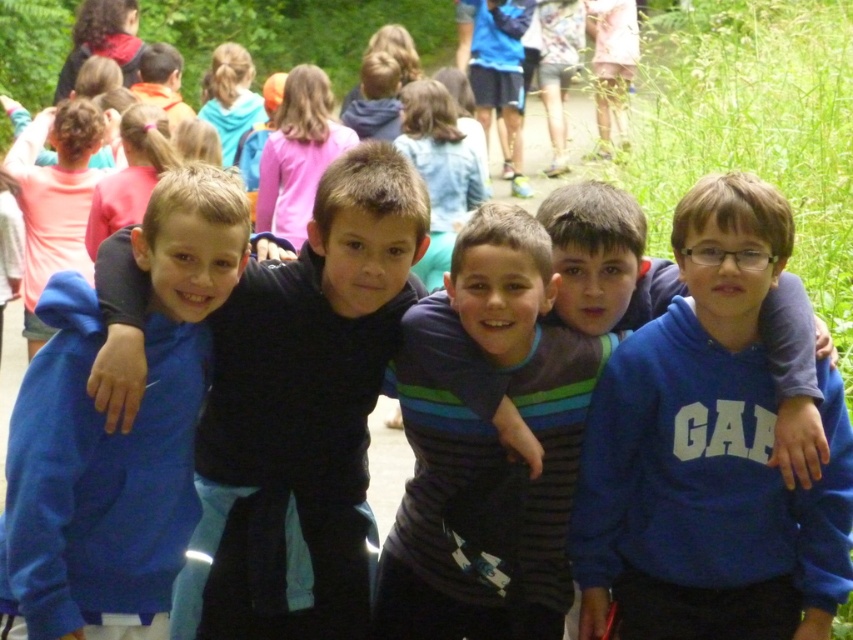
You are a photographer trying to capture a closeup of the blue fleece sweatshirt at center. Since the blue fleece jacket at center is blocking your view, can you determine which item you should adjust to get a clear shot?

The blue fleece sweatshirt at center is below the blue fleece jacket at center. To get a clear shot, you should lower your camera angle to look under the jacket or ask someone to move the jacket slightly upwards.

You are a photographer trying to capture a clear photo of the children. The blue fleece sweatshirt at center and the blue fleece jacket at center are both in the frame. Which one is more likely to be in focus if you focus on the center of the image?

The blue fleece sweatshirt at center is much taller than the blue fleece jacket at center, so focusing on the center would likely put the blue fleece sweatshirt at center in focus first since it occupies more of the central area.